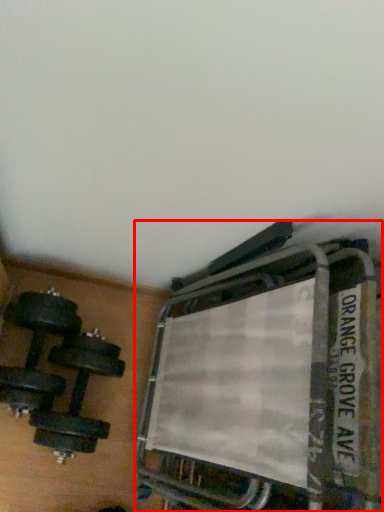
Question: Where is bunk bed (annotated by the red box) located in relation to dumbbell in the image?

Choices:
 (A) left
 (B) right

Answer: (B)